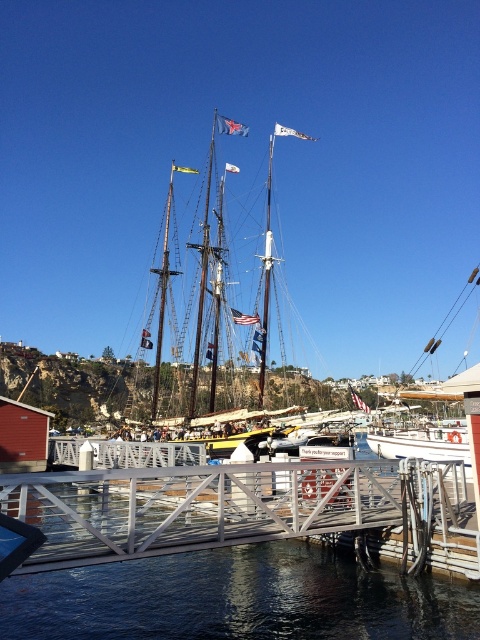
Question: Which point is farther to the camera?

Choices:
 (A) (212, 364)
 (B) (274, 573)
 (C) (452, 433)

Answer: (A)

Question: Which object is farther from the camera taking this photo?

Choices:
 (A) white matte sailboat at center
 (B) clear water at center
 (C) wooden ship at center

Answer: (C)

Question: Is clear water at center behind white matte sailboat at center?

Choices:
 (A) no
 (B) yes

Answer: (A)

Question: Is clear water at center bigger than white matte sailboat at center?

Choices:
 (A) yes
 (B) no

Answer: (B)

Question: Does clear water at center have a greater width compared to wooden ship at center?

Choices:
 (A) no
 (B) yes

Answer: (A)

Question: Which of the following is the closest to the observer?

Choices:
 (A) wooden ship at center
 (B) clear water at center

Answer: (B)